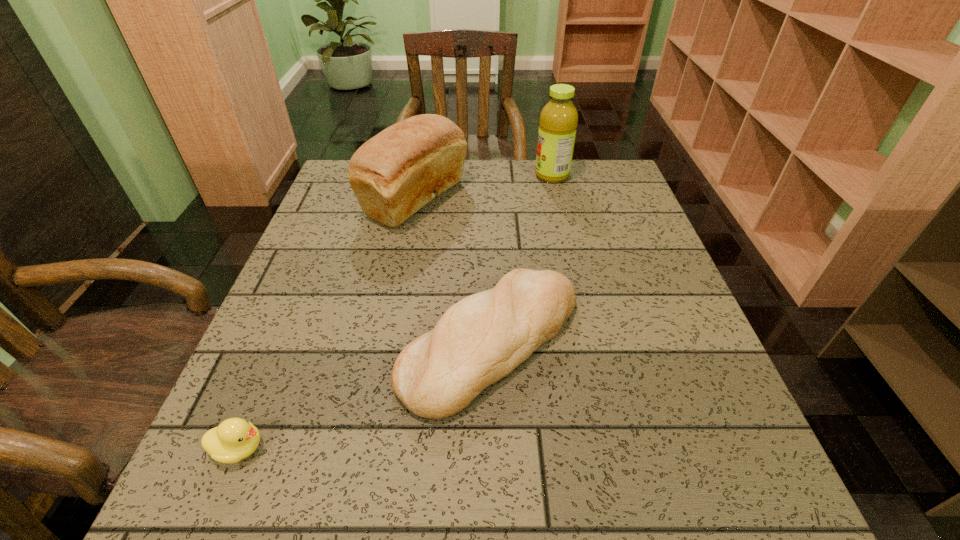
Identify the location of object that is at the near left corner. The image size is (960, 540). (235, 439).

Locate an element on the screen. This screenshot has height=540, width=960. object at the far right corner is located at coordinates (558, 121).

The width and height of the screenshot is (960, 540). In order to click on vacant region at the far edge of the desktop in this screenshot , I will do `click(501, 190)`.

In the image, there is a desktop. Where is `free region at the near edge`? This screenshot has height=540, width=960. free region at the near edge is located at coordinates (455, 522).

In the image, there is a desktop. At what (x,y) coordinates should I click in order to perform the action: click on vacant space at the left edge. Please return your answer as a coordinate pair (x, y). Image resolution: width=960 pixels, height=540 pixels. Looking at the image, I should click on (361, 277).

Where is `vacant space at the right edge`? This screenshot has height=540, width=960. vacant space at the right edge is located at coordinates (607, 213).

In the image, there is a desktop. In order to click on free space at the near left corner in this screenshot , I will do `click(242, 487)`.

In the image, there is a desktop. In order to click on free space at the far right corner in this screenshot , I will do [x=596, y=205].

Locate an element on the screen. This screenshot has width=960, height=540. unoccupied area between the fruit juice and the taller bread is located at coordinates (484, 187).

Image resolution: width=960 pixels, height=540 pixels. I want to click on vacant area that lies between the nearer bread and the tallest object, so click(521, 259).